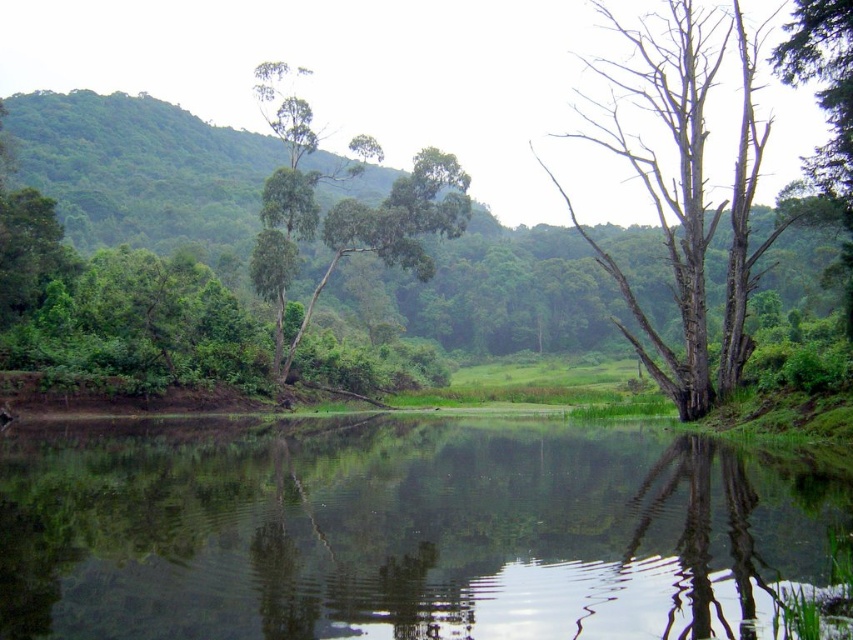
You are a bird looking for a nesting spot. You see the bare wood tree at right and the green leafy tree at upper center. Which tree is taller and would provide a better vantage point?

The bare wood tree at right is taller than the green leafy tree at upper center, so it would provide a better vantage point for nesting.

You are a photographer trying to capture the reflection of the dead tree in the green reflective water at center. Based on the scene description, where should you position your camera to ensure the dead tree is fully reflected in the water?

The green reflective water at center is located at point (399, 532). To capture the reflection of the dead tree in the water, position your camera directly above or in line with this point to ensure the reflection is visible and the dead tree is fully reflected in the water.